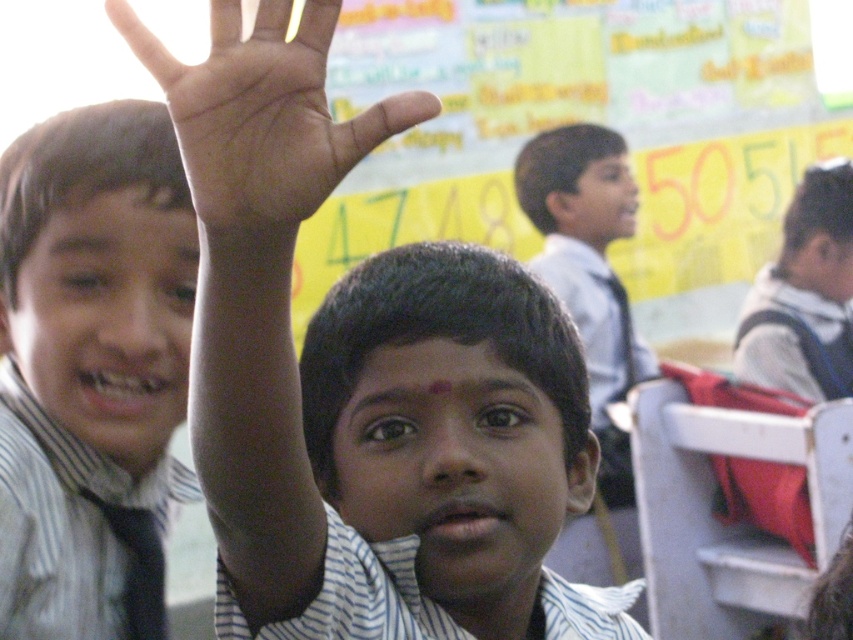
Looking at this image, in the classroom scene, where exactly is the striped shirt at left located?

The striped shirt at left is located at point 0.578 on the x axis and 0.108 on the y axis.

Looking at this image, you are a teacher in the classroom and want to hand out a small sticker to the student with the dark skin palm at upper center and a larger sticker to the student with the white fabric backpack at right. Which student should get the larger sticker based on the size of their hands?

The white fabric backpack at right should receive the larger sticker because the dark skin palm at upper center has a smaller size compared to the white fabric backpack at right.

You are a teacher observing the classroom scene. You notice the striped shirt at left and the dark skin palm at upper center. Which object is located more to the left side of the scene?

The striped shirt at left is positioned on the left side of dark skin palm at upper center, so the striped shirt at left is more to the left.